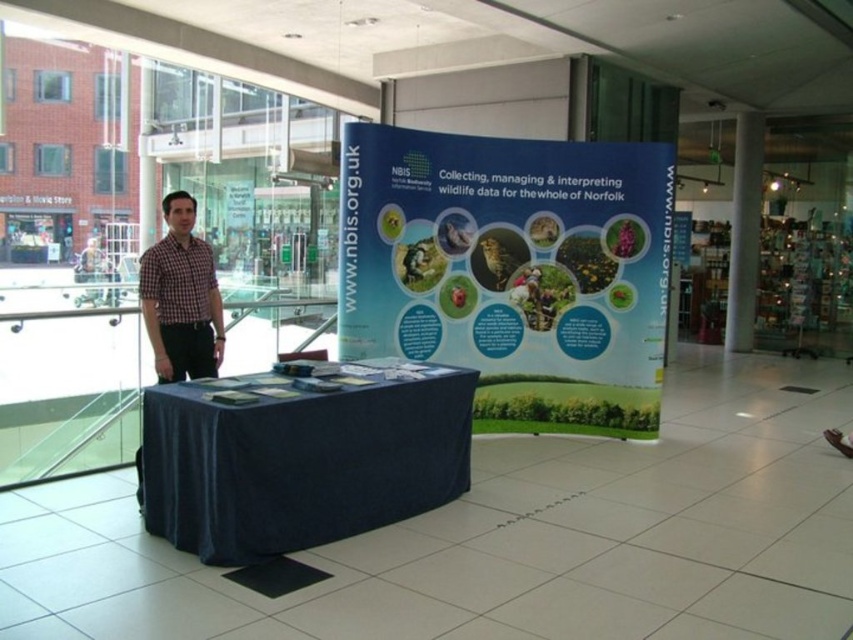
Does point (403, 385) come farther from viewer compared to point (177, 269)?

No, (403, 385) is closer to viewer.

How distant is blue fabric table at center from checkered fabric shirt at left?

blue fabric table at center is 3.78 feet from checkered fabric shirt at left.

Is point (152, 417) positioned after point (189, 310)?

No, it is in front of (189, 310).

Locate an element on the screen. The height and width of the screenshot is (640, 853). blue fabric table at center is located at coordinates (300, 456).

Does blue fabric poster at center have a larger size compared to checkered fabric shirt at left?

Yes, blue fabric poster at center is bigger than checkered fabric shirt at left.

Which is behind, point (636, 234) or point (187, 266)?

Positioned behind is point (636, 234).

Is point (392, 339) closer to viewer compared to point (154, 296)?

No.

Find the location of a particular element. The width and height of the screenshot is (853, 640). blue fabric poster at center is located at coordinates pyautogui.click(x=512, y=269).

Describe the element at coordinates (512, 269) in the screenshot. The width and height of the screenshot is (853, 640). I see `blue fabric poster at center` at that location.

Locate an element on the screen. The height and width of the screenshot is (640, 853). blue fabric poster at center is located at coordinates (512, 269).